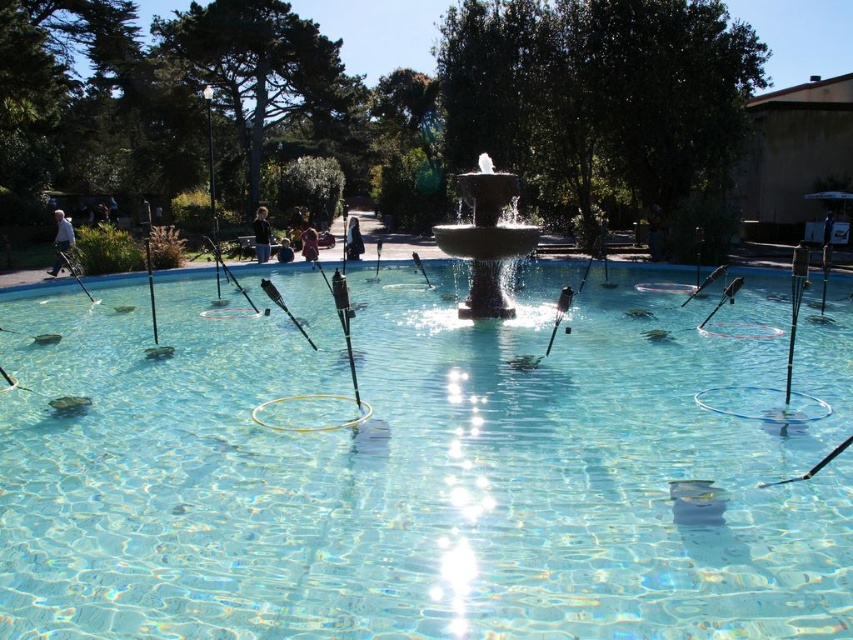
You are a visitor at the park and want to take a photo of the clear glass swimming pool at center without the dark blue jeans at center appearing in the frame. Is this possible based on their positions?

The clear glass swimming pool at center is in front of the dark blue jeans at center, so you can take a photo of the clear glass swimming pool at center by positioning yourself so that the dark blue jeans at center is out of the frame behind it.